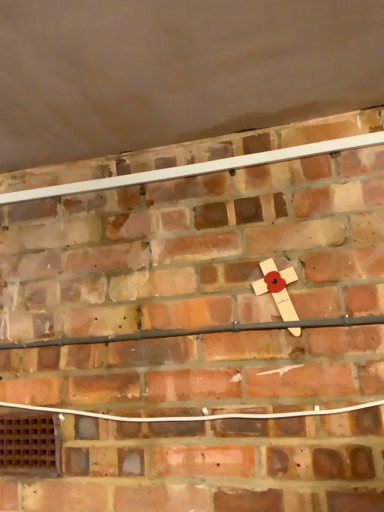
Measure the distance between point (285, 282) and camera.

The distance of point (285, 282) from camera is 36.61 inches.

What do you see at coordinates (277, 287) in the screenshot?
I see `wooden cross at center` at bounding box center [277, 287].

Image resolution: width=384 pixels, height=512 pixels. What are the coordinates of `wooden cross at center` in the screenshot? It's located at (277, 287).

This screenshot has height=512, width=384. Describe the element at coordinates (30, 444) in the screenshot. I see `brown wooden vent at lower left` at that location.

Identify the location of brown wooden vent at lower left. (30, 444).

The height and width of the screenshot is (512, 384). What are the coordinates of `wooden cross at center` in the screenshot? It's located at (277, 287).

Is wooden cross at center at the right side of brown wooden vent at lower left?

Indeed, wooden cross at center is positioned on the right side of brown wooden vent at lower left.

Is wooden cross at center behind brown wooden vent at lower left?

That is False.

Does point (279, 273) lie in front of point (34, 444)?

That is True.

From the image's perspective, is wooden cross at center on brown wooden vent at lower left?

Yes, from the image's perspective, wooden cross at center is on top of brown wooden vent at lower left.

From a real-world perspective, which is physically above, wooden cross at center or brown wooden vent at lower left?

In real-world perspective, wooden cross at center is above.

Does wooden cross at center have a greater width compared to brown wooden vent at lower left?

Yes.

Which of these two, wooden cross at center or brown wooden vent at lower left, stands taller?

wooden cross at center.

Does wooden cross at center have a smaller size compared to brown wooden vent at lower left?

Actually, wooden cross at center might be larger than brown wooden vent at lower left.

Consider the image. Is wooden cross at center inside or outside of brown wooden vent at lower left?

wooden cross at center is outside brown wooden vent at lower left.

Are wooden cross at center and brown wooden vent at lower left beside each other?

No, wooden cross at center is not touching brown wooden vent at lower left.

Is wooden cross at center facing away from brown wooden vent at lower left?

That's not correct — wooden cross at center is not looking away from brown wooden vent at lower left.

Consider the image. How much distance is there between wooden cross at center and brown wooden vent at lower left?

wooden cross at center and brown wooden vent at lower left are 25.42 inches apart.

Locate an element on the screen. The width and height of the screenshot is (384, 512). window that is under the wooden cross at center (from a real-world perspective) is located at coordinates (30, 444).

Considering the positions of objects brown wooden vent at lower left and wooden cross at center in the image provided, who is more to the right, brown wooden vent at lower left or wooden cross at center?

wooden cross at center is more to the right.

Is brown wooden vent at lower left positioned in front of wooden cross at center?

No, the depth of brown wooden vent at lower left is greater than that of wooden cross at center.

Is point (32, 430) farther from camera compared to point (267, 286)?

Yes, it is.

From the picture: From the image's perspective, is brown wooden vent at lower left over wooden cross at center?

No, from the image's perspective, brown wooden vent at lower left is not on top of wooden cross at center.

From a real-world perspective, relative to wooden cross at center, is brown wooden vent at lower left vertically above or below?

brown wooden vent at lower left is situated lower than wooden cross at center in the real world.

Considering the sizes of brown wooden vent at lower left and wooden cross at center in the image, is brown wooden vent at lower left wider or thinner than wooden cross at center?

Clearly, brown wooden vent at lower left has less width compared to wooden cross at center.

Between brown wooden vent at lower left and wooden cross at center, which one has more height?

wooden cross at center.

Which of these two, brown wooden vent at lower left or wooden cross at center, is smaller?

With smaller size is brown wooden vent at lower left.

Would you say brown wooden vent at lower left is inside or outside wooden cross at center?

brown wooden vent at lower left is not enclosed by wooden cross at center.

Is brown wooden vent at lower left in contact with wooden cross at center?

No, brown wooden vent at lower left is not touching wooden cross at center.

Is brown wooden vent at lower left oriented away from wooden cross at center?

brown wooden vent at lower left is not turned away from wooden cross at center.

How many degrees apart are the facing directions of brown wooden vent at lower left and wooden cross at center?

The angle between the facing direction of brown wooden vent at lower left and the facing direction of wooden cross at center is 0.102 degrees.

Locate an element on the screen. The image size is (384, 512). window behind the wooden cross at center is located at coordinates point(30,444).

At what (x,y) coordinates should I click in order to perform the action: click on magnet on the right of brown wooden vent at lower left. Please return your answer as a coordinate pair (x, y). Image resolution: width=384 pixels, height=512 pixels. Looking at the image, I should click on (277, 287).

Identify the location of window below the wooden cross at center (from the image's perspective). The image size is (384, 512). (30, 444).